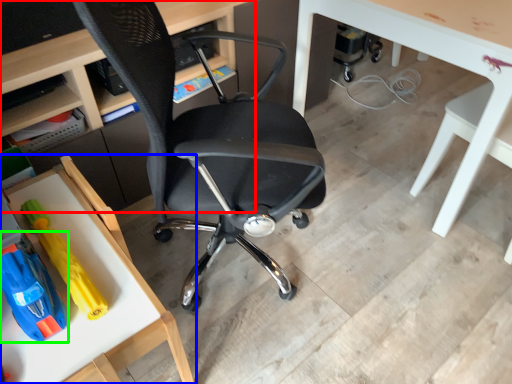
Question: Estimate the real-world distances between objects in this image. Which object is farther from desk (highlighted by a red box), table (highlighted by a blue box) or toy (highlighted by a green box)?

Choices:
 (A) table
 (B) toy

Answer: (B)